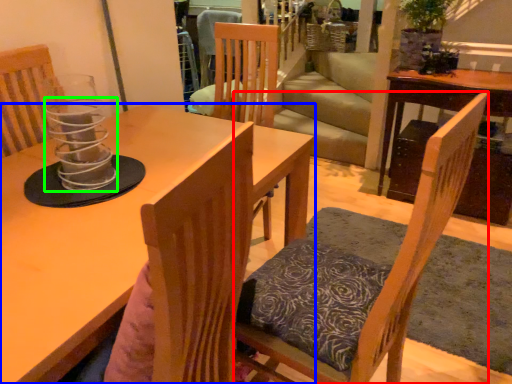
Question: Which object is the closest to the chair (highlighted by a red box)? Choose among these: table (highlighted by a blue box) or candle holder (highlighted by a green box).

Choices:
 (A) table
 (B) candle holder

Answer: (A)